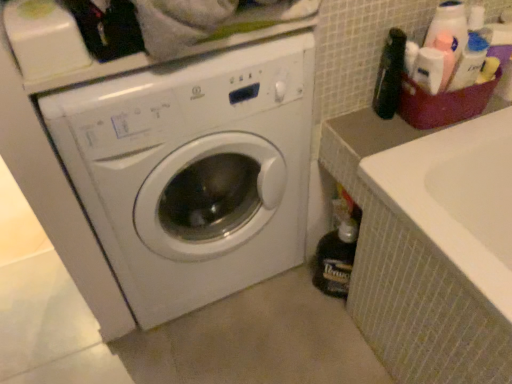
Locate an element on the screen. The width and height of the screenshot is (512, 384). free space to the left of black plastic bottle at upper right, the 2th bottle ordered from the bottom is located at coordinates (353, 124).